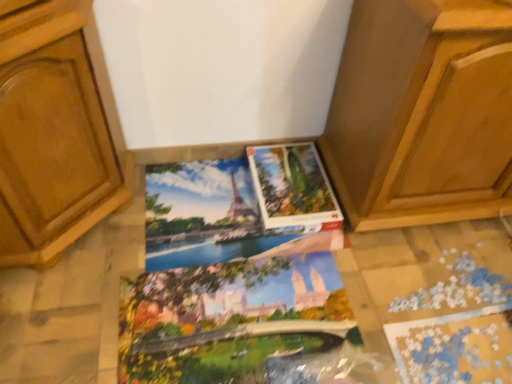
The image size is (512, 384). Find the location of `free space below matte paper coloring book at center, placed as the first coloring book when sorted from top to bottom (from a real-world perspective)`. free space below matte paper coloring book at center, placed as the first coloring book when sorted from top to bottom (from a real-world perspective) is located at coordinates (204, 211).